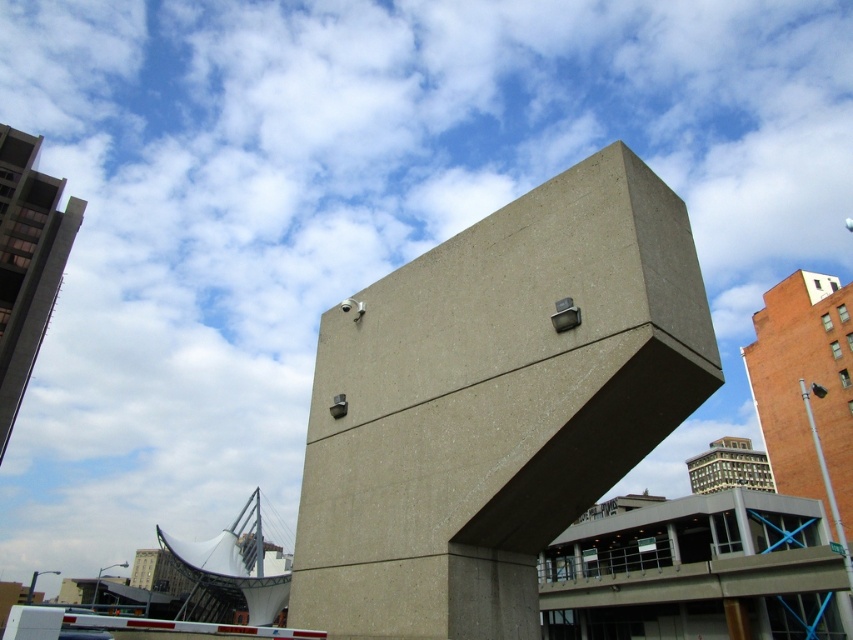
Which is more to the left, gray concrete cube at center or white fabric sculpture at lower left?

white fabric sculpture at lower left

Does point (663, 182) lie behind point (236, 557)?

No, (663, 182) is in front of (236, 557).

Who is more forward, (x=390, y=547) or (x=187, y=545)?

Point (x=390, y=547) is in front.

Locate an element on the screen. The width and height of the screenshot is (853, 640). gray concrete cube at center is located at coordinates (494, 403).